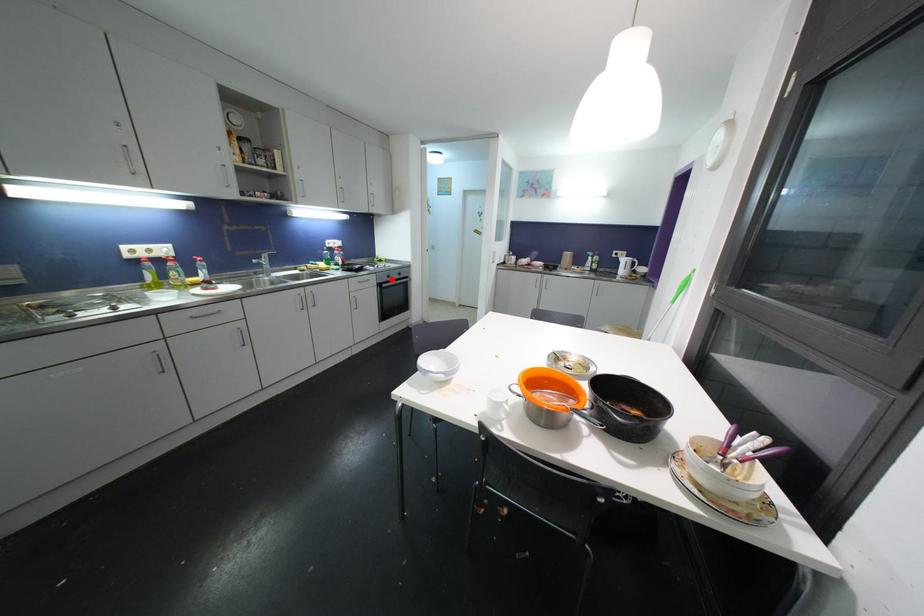
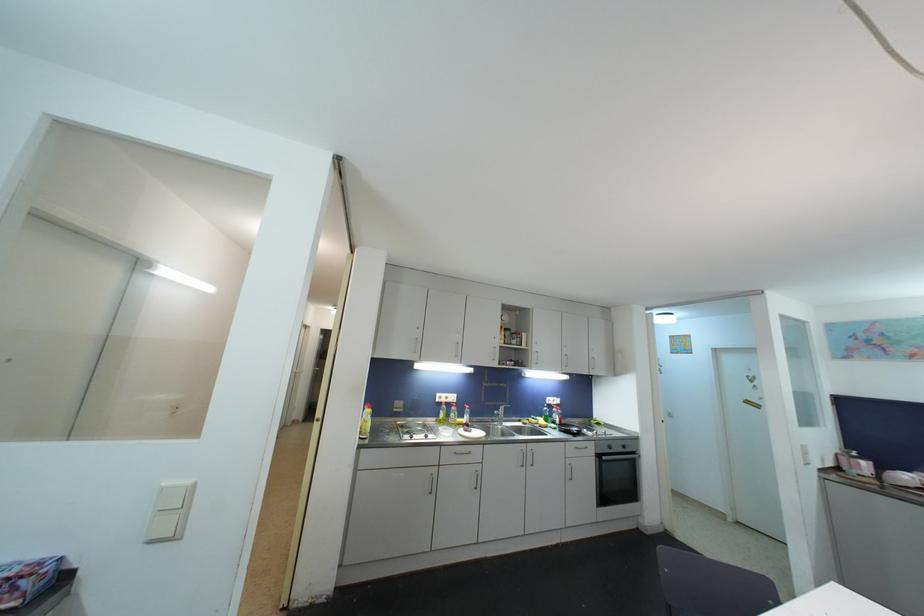
Locate, in the second image, the point that corresponds to the highlighted location in the first image.

(613, 450)